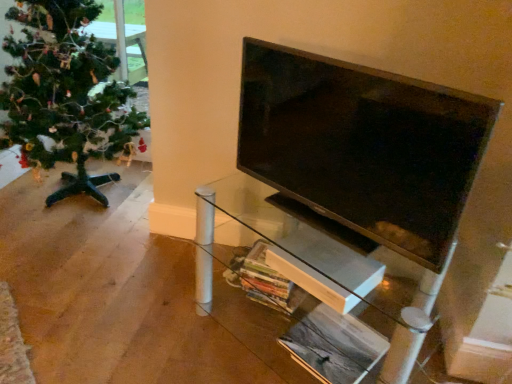
What do you see at coordinates (362, 148) in the screenshot? I see `matte black tv at center` at bounding box center [362, 148].

Measure the distance between green matte christmas tree at left and camera.

5.94 feet.

Image resolution: width=512 pixels, height=384 pixels. In order to click on matte black tv at center in this screenshot , I will do `click(362, 148)`.

Is transparent glass tv stand at center positioned beyond the bounds of green matte christmas tree at left?

Absolutely, transparent glass tv stand at center is external to green matte christmas tree at left.

From the image's perspective, between transparent glass tv stand at center and green matte christmas tree at left, which one is located above?

green matte christmas tree at left is shown above in the image.

In terms of size, does transparent glass tv stand at center appear bigger or smaller than green matte christmas tree at left?

transparent glass tv stand at center is smaller than green matte christmas tree at left.

Could you tell me if transparent glass tv stand at center is turned towards green matte christmas tree at left?

No, transparent glass tv stand at center is not oriented towards green matte christmas tree at left.

Which is more to the left, matte black tv at center or green matte christmas tree at left?

Positioned to the left is green matte christmas tree at left.

Would you say matte black tv at center is inside or outside green matte christmas tree at left?

matte black tv at center is spatially situated outside green matte christmas tree at left.

Find the location of a particular element. christmas tree that appears below the matte black tv at center (from a real-world perspective) is located at coordinates (65, 94).

Is matte black tv at center beside transparent glass tv stand at center?

No, matte black tv at center is not next to transparent glass tv stand at center.

Could you tell me if matte black tv at center is turned towards transparent glass tv stand at center?

No, matte black tv at center is not turned towards transparent glass tv stand at center.

Which object is positioned more to the left, matte black tv at center or transparent glass tv stand at center?

matte black tv at center is more to the left.

Which is behind, point (98, 58) or point (267, 104)?

The point (98, 58) is farther.

From the picture: Who is bigger, green matte christmas tree at left or matte black tv at center?

With larger size is green matte christmas tree at left.

Would you consider green matte christmas tree at left to be distant from matte black tv at center?

Yes, green matte christmas tree at left and matte black tv at center are located far from each other.

From a real-world perspective, which is physically above, green matte christmas tree at left or matte black tv at center?

matte black tv at center, from a real-world perspective.

Is green matte christmas tree at left at the left side of transparent glass tv stand at center?

Indeed, green matte christmas tree at left is positioned on the left side of transparent glass tv stand at center.

Is green matte christmas tree at left taller than transparent glass tv stand at center?

Yes.

Is green matte christmas tree at left aimed at transparent glass tv stand at center?

No, green matte christmas tree at left is not aimed at transparent glass tv stand at center.

In terms of size, does green matte christmas tree at left appear bigger or smaller than transparent glass tv stand at center?

Clearly, green matte christmas tree at left is larger in size than transparent glass tv stand at center.

Is matte black tv at center located within transparent glass tv stand at center?

No, matte black tv at center is not surrounded by transparent glass tv stand at center.

Based on the photo, how many degrees apart are the facing directions of transparent glass tv stand at center and matte black tv at center?

They differ by 0.215 degrees in their facing directions.

I want to click on television that is above the transparent glass tv stand at center (from a real-world perspective), so click(362, 148).

Is transparent glass tv stand at center smaller than matte black tv at center?

No.

Find the location of a particular element. furniture in front of the green matte christmas tree at left is located at coordinates (324, 293).

This screenshot has height=384, width=512. What are the coordinates of `christmas tree to the left of matte black tv at center` in the screenshot? It's located at (65, 94).

Based on their spatial positions, is matte black tv at center or green matte christmas tree at left further from transparent glass tv stand at center?

green matte christmas tree at left is further to transparent glass tv stand at center.

When comparing their distances from green matte christmas tree at left, does transparent glass tv stand at center or matte black tv at center seem closer?

transparent glass tv stand at center.

When comparing their distances from matte black tv at center, does transparent glass tv stand at center or green matte christmas tree at left seem closer?

transparent glass tv stand at center is positioned closer to the anchor matte black tv at center.

In the scene shown: Looking at the image, which one is located closer to transparent glass tv stand at center, green matte christmas tree at left or matte black tv at center?

matte black tv at center lies closer to transparent glass tv stand at center than the other object.

Considering their positions, is green matte christmas tree at left positioned further to matte black tv at center than transparent glass tv stand at center?

Answer: The object further to matte black tv at center is green matte christmas tree at left.

Estimate the real-world distances between objects in this image. Which object is closer to green matte christmas tree at left, matte black tv at center or transparent glass tv stand at center?

transparent glass tv stand at center lies closer to green matte christmas tree at left than the other object.

Locate an element on the screen. The width and height of the screenshot is (512, 384). television between green matte christmas tree at left and transparent glass tv stand at center from left to right is located at coordinates (362, 148).